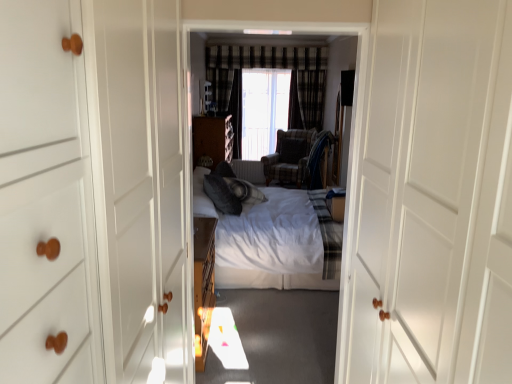
Question: From the image's perspective, is transparent plastic window screen at center under matte brown cabinet at center?

Choices:
 (A) no
 (B) yes

Answer: (A)

Question: Is the depth of transparent plastic window screen at center greater than that of matte brown cabinet at center?

Choices:
 (A) yes
 (B) no

Answer: (A)

Question: Is transparent plastic window screen at center facing towards matte brown cabinet at center?

Choices:
 (A) no
 (B) yes

Answer: (B)

Question: Is transparent plastic window screen at center not within matte brown cabinet at center?

Choices:
 (A) yes
 (B) no

Answer: (A)

Question: From a real-world perspective, does transparent plastic window screen at center stand above matte brown cabinet at center?

Choices:
 (A) no
 (B) yes

Answer: (B)

Question: Considering the relative sizes of transparent plastic window screen at center and matte brown cabinet at center in the image provided, is transparent plastic window screen at center wider than matte brown cabinet at center?

Choices:
 (A) yes
 (B) no

Answer: (B)

Question: Can you confirm if white wood door at center is bigger than plaid fabric armchair at center?

Choices:
 (A) yes
 (B) no

Answer: (A)

Question: Can you confirm if white wood door at center is thinner than plaid fabric armchair at center?

Choices:
 (A) yes
 (B) no

Answer: (A)

Question: Would you say white wood door at center is a long distance from plaid fabric armchair at center?

Choices:
 (A) yes
 (B) no

Answer: (A)

Question: From the image's perspective, does white wood door at center appear higher than plaid fabric armchair at center?

Choices:
 (A) no
 (B) yes

Answer: (A)

Question: Can you confirm if white wood door at center is shorter than plaid fabric armchair at center?

Choices:
 (A) no
 (B) yes

Answer: (A)

Question: Is white wood door at center at the right side of plaid fabric armchair at center?

Choices:
 (A) yes
 (B) no

Answer: (A)

Question: Is white wood door at center at the right side of transparent plastic window screen at center?

Choices:
 (A) yes
 (B) no

Answer: (A)